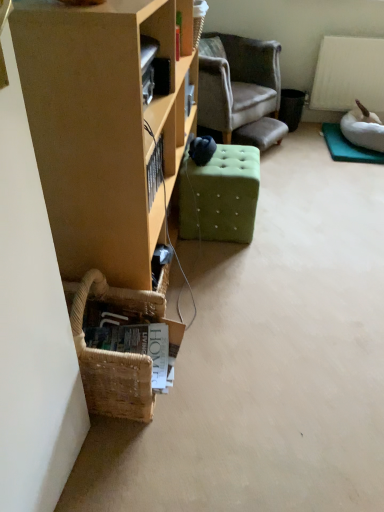
This screenshot has height=512, width=384. Identify the location of empty space that is ontop of green tufted ottoman at center (from a real-world perspective). (231, 156).